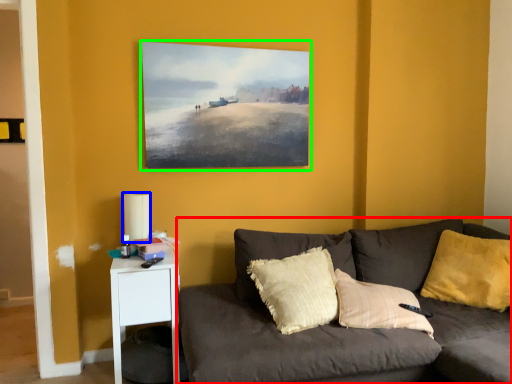
Question: Which object is the farthest from studio couch (highlighted by a red box)? Choose among these: lamp (highlighted by a blue box) or picture frame (highlighted by a green box).

Choices:
 (A) lamp
 (B) picture frame

Answer: (A)